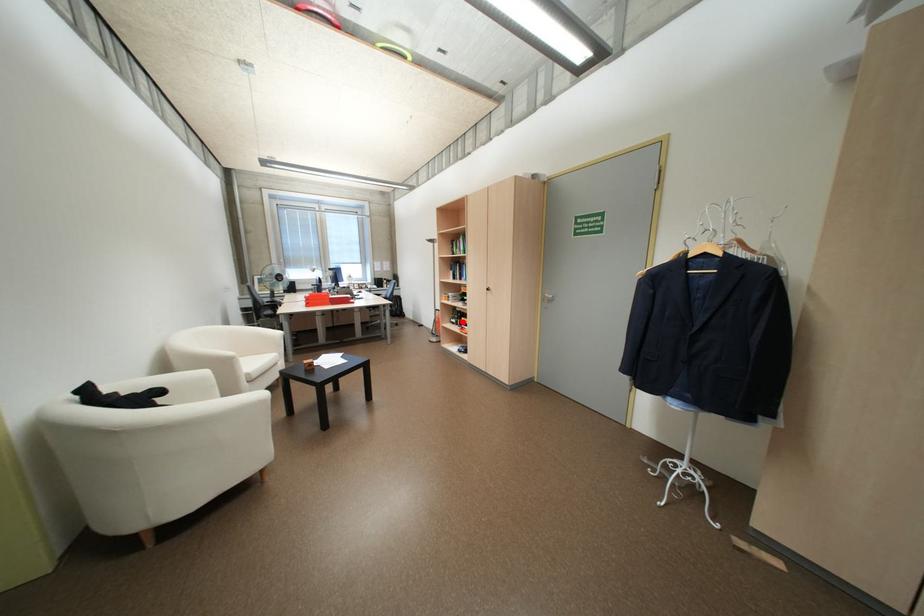
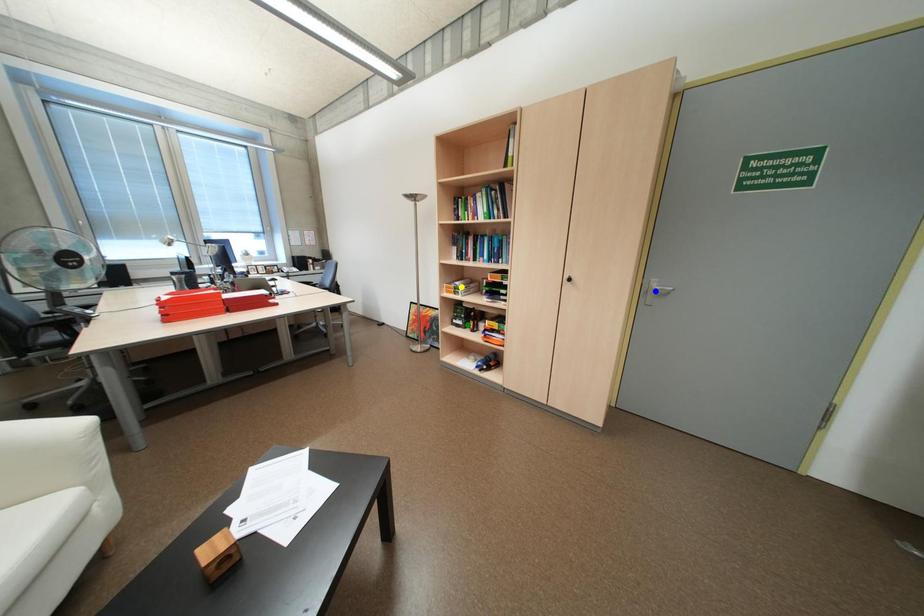
Question: I am providing you with two images of the same scene from different viewpoints. A red point is marked on the first image. You are given multiple points on the second image. Which point in image 2 is actually the same real-world point as the red point in image 1?

Choices:
 (A) green point
 (B) yellow point
 (C) blue point

Answer: (A)